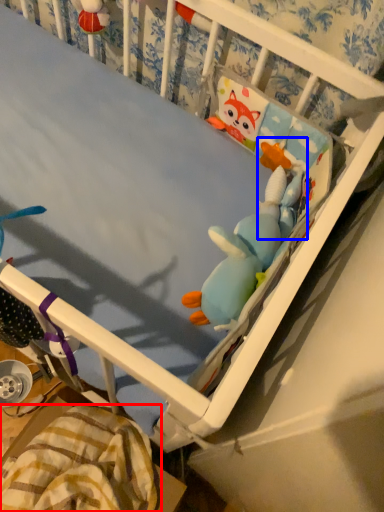
Question: Which of the following is the closest to the observer, blanket (highlighted by a red box) or toy (highlighted by a blue box)?

Choices:
 (A) blanket
 (B) toy

Answer: (A)